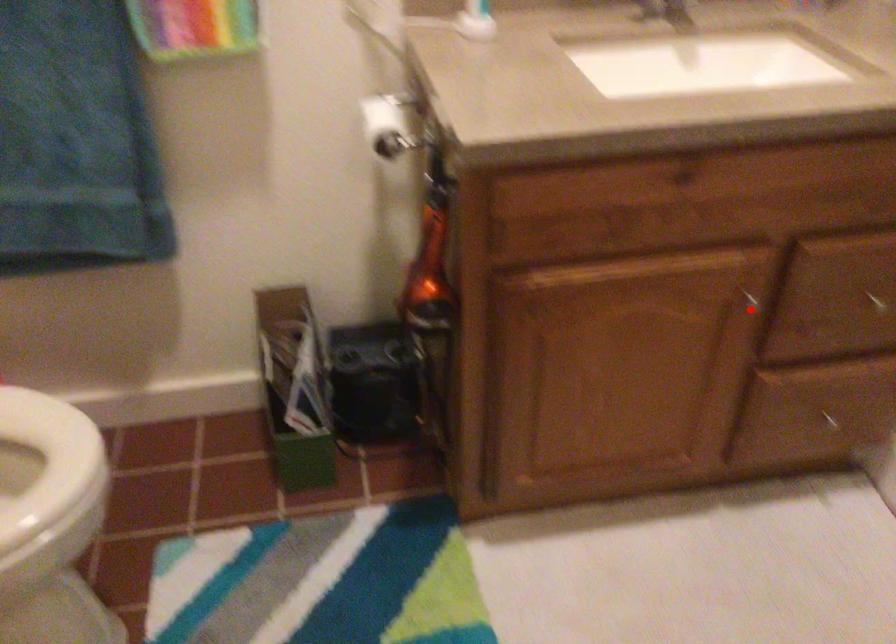
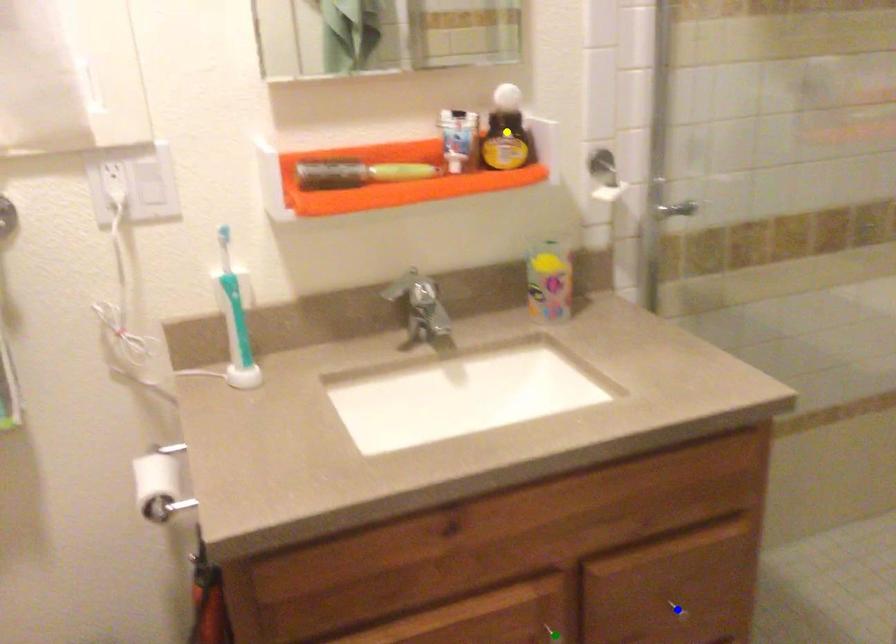
Question: I am providing you with two images of the same scene from different viewpoints. A red point is marked on the first image. You are given multiple points on the second image. Which point in image 2 represents the same 3d spot as the red point in image 1?

Choices:
 (A) blue point
 (B) yellow point
 (C) green point

Answer: (C)